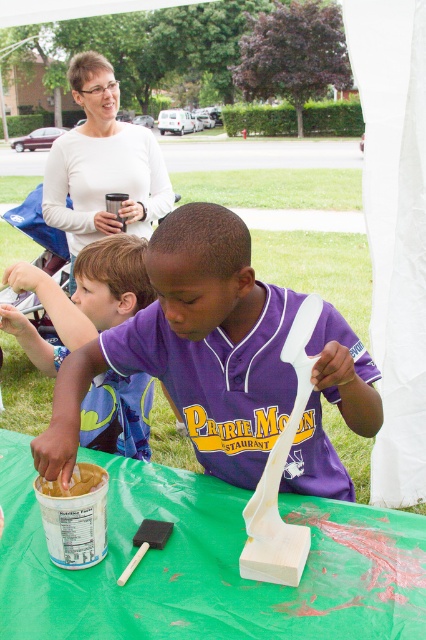
Question: Where is green fabric table at center located in relation to smooth beige paste at lower left in the image?

Choices:
 (A) above
 (B) below

Answer: (B)

Question: Which object is farther from the camera taking this photo?

Choices:
 (A) purple jersey at center
 (B) smooth beige paste at lower left
 (C) matte purple jersey at center

Answer: (C)

Question: Is green fabric table at center smaller than matte purple jersey at center?

Choices:
 (A) no
 (B) yes

Answer: (B)

Question: Can you confirm if green fabric table at center is bigger than purple jersey at center?

Choices:
 (A) no
 (B) yes

Answer: (A)

Question: Which point is farther to the camera?

Choices:
 (A) (57, 492)
 (B) (131, 316)
 (C) (253, 349)

Answer: (B)

Question: Considering the real-world distances, which object is closest to the matte purple jersey at center?

Choices:
 (A) green fabric table at center
 (B) smooth beige paste at lower left
 (C) purple jersey at center

Answer: (C)